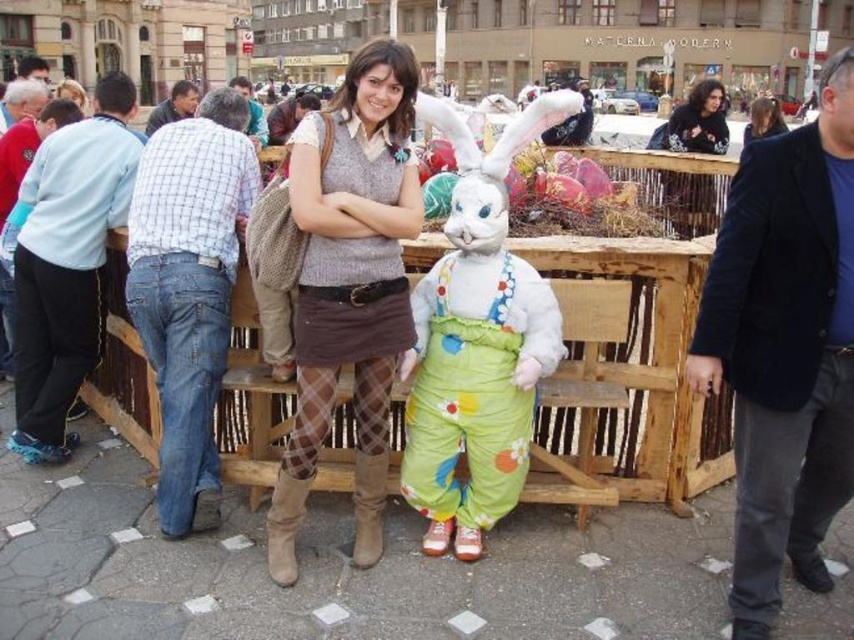
Can you confirm if blue jeans at left is thinner than matte brown sweater at center?

Yes.

Between point (182, 128) and point (69, 99), which one is positioned behind?

The point (69, 99) is more distant.

Describe the element at coordinates (188, 284) in the screenshot. I see `blue jeans at left` at that location.

Where is `blue jeans at left`? This screenshot has height=640, width=854. blue jeans at left is located at coordinates (188, 284).

Is light blue fleece jacket at left to the left of brown suede boot at lower center from the viewer's perspective?

Yes, light blue fleece jacket at left is to the left of brown suede boot at lower center.

Which is in front, point (118, 180) or point (290, 490)?

Point (290, 490) is more forward.

The height and width of the screenshot is (640, 854). In order to click on light blue fleece jacket at left in this screenshot , I will do 67,262.

Is the position of fluffy white bunny at center less distant than that of gray hair at upper left?

Yes.

Measure the distance between fluffy white bunny at center and camera.

fluffy white bunny at center and camera are 30.15 meters apart from each other.

This screenshot has width=854, height=640. I want to click on fluffy white bunny at center, so (x=477, y=340).